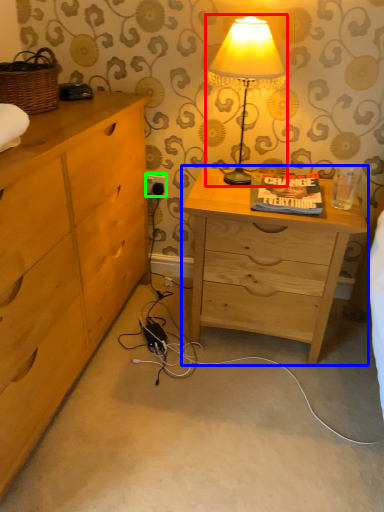
Question: Which object is the farthest from lamp (highlighted by a red box)? Choose among these: nightstand (highlighted by a blue box) or electric outlet (highlighted by a green box).

Choices:
 (A) nightstand
 (B) electric outlet

Answer: (B)